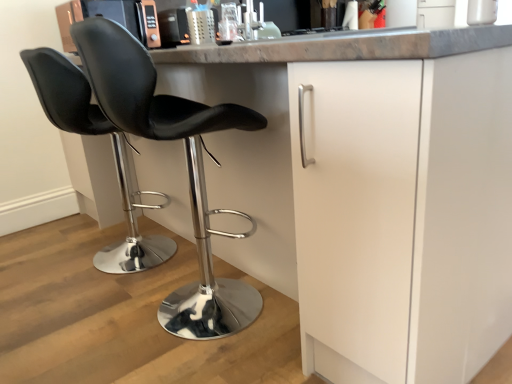
Where is `vacant space in front of black leather chair at center, the 2th chair when ordered from right to left`? This screenshot has height=384, width=512. vacant space in front of black leather chair at center, the 2th chair when ordered from right to left is located at coordinates 74,311.